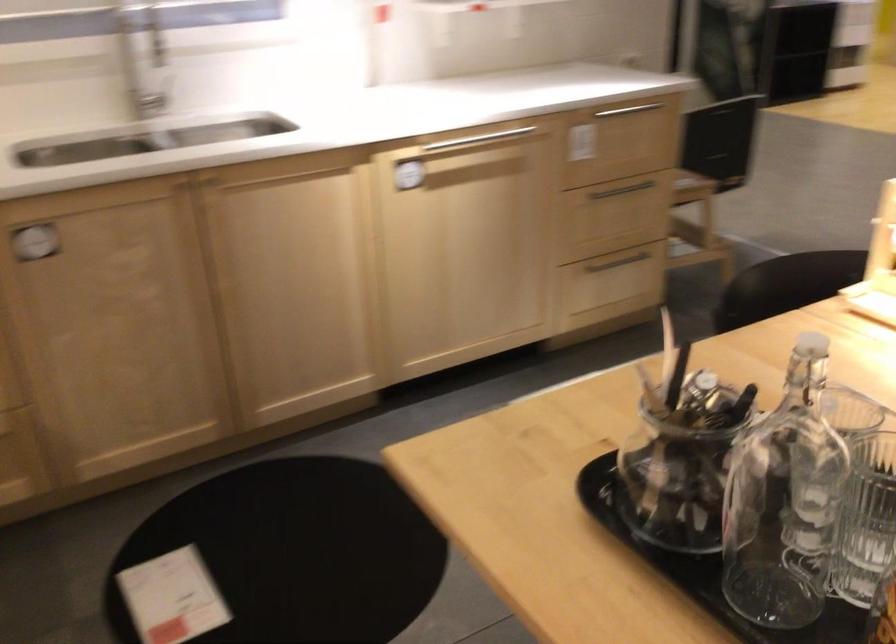
Where is `bottle stopper`? bottle stopper is located at coordinates (814, 351).